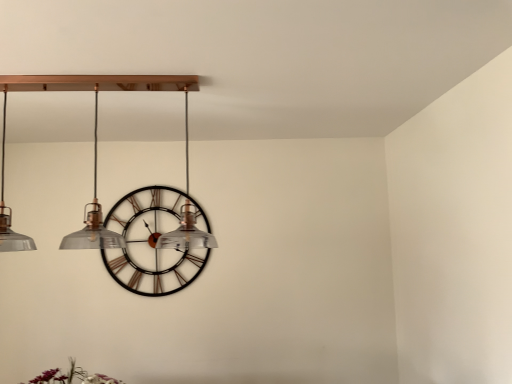
This screenshot has height=384, width=512. What do you see at coordinates (153, 242) in the screenshot?
I see `metallic black clock at center` at bounding box center [153, 242].

Identify the location of metallic black clock at center. This screenshot has width=512, height=384. (153, 242).

Identify the location of matte glass chandelier at upper center. (94, 144).

Describe the element at coordinates (94, 144) in the screenshot. I see `matte glass chandelier at upper center` at that location.

Locate an element on the screen. Image resolution: width=512 pixels, height=384 pixels. metallic black clock at center is located at coordinates (153, 242).

Looking at this image, considering the relative positions of matte glass chandelier at upper center and metallic black clock at center in the image provided, is matte glass chandelier at upper center to the right of metallic black clock at center from the viewer's perspective?

Indeed, matte glass chandelier at upper center is positioned on the right side of metallic black clock at center.

Is matte glass chandelier at upper center in front of or behind metallic black clock at center in the image?

In the image, matte glass chandelier at upper center appears in front of metallic black clock at center.

Is point (131, 84) positioned behind point (192, 257)?

No.

From the image's perspective, is matte glass chandelier at upper center on top of metallic black clock at center?

Yes, from the image's perspective, matte glass chandelier at upper center is on top of metallic black clock at center.

From a real-world perspective, does matte glass chandelier at upper center sit lower than metallic black clock at center?

Actually, matte glass chandelier at upper center is physically above metallic black clock at center in the real world.

Which of these two, matte glass chandelier at upper center or metallic black clock at center, is wider?

matte glass chandelier at upper center is wider.

Is matte glass chandelier at upper center taller or shorter than metallic black clock at center?

matte glass chandelier at upper center is shorter than metallic black clock at center.

Considering the relative sizes of matte glass chandelier at upper center and metallic black clock at center in the image provided, is matte glass chandelier at upper center smaller than metallic black clock at center?

No, matte glass chandelier at upper center is not smaller than metallic black clock at center.

From the picture: Is metallic black clock at center inside matte glass chandelier at upper center?

No, matte glass chandelier at upper center does not contain metallic black clock at center.

Would you consider matte glass chandelier at upper center to be distant from metallic black clock at center?

That's right, there is a large distance between matte glass chandelier at upper center and metallic black clock at center.

Is metallic black clock at center at the back of matte glass chandelier at upper center?

Yes, matte glass chandelier at upper center's orientation is away from metallic black clock at center.

How many degrees apart are the facing directions of matte glass chandelier at upper center and metallic black clock at center?

matte glass chandelier at upper center and metallic black clock at center are facing 2.84 degrees away from each other.

Identify the location of chandelier above the metallic black clock at center (from a real-world perspective). The height and width of the screenshot is (384, 512). (94, 144).

Considering the relative positions of metallic black clock at center and matte glass chandelier at upper center in the image provided, is metallic black clock at center to the right of matte glass chandelier at upper center from the viewer's perspective?

No, metallic black clock at center is not to the right of matte glass chandelier at upper center.

Which object is more forward, metallic black clock at center or matte glass chandelier at upper center?

Positioned in front is matte glass chandelier at upper center.

Which is behind, point (144, 210) or point (29, 81)?

Positioned behind is point (144, 210).

From the image's perspective, which is below, metallic black clock at center or matte glass chandelier at upper center?

metallic black clock at center.

From a real-world perspective, is metallic black clock at center above or below matte glass chandelier at upper center?

metallic black clock at center is below matte glass chandelier at upper center.

Between metallic black clock at center and matte glass chandelier at upper center, which one has larger width?

matte glass chandelier at upper center.

Considering the sizes of objects metallic black clock at center and matte glass chandelier at upper center in the image provided, who is taller, metallic black clock at center or matte glass chandelier at upper center?

Standing taller between the two is metallic black clock at center.

Between metallic black clock at center and matte glass chandelier at upper center, which one has larger size?

matte glass chandelier at upper center.

Is matte glass chandelier at upper center inside metallic black clock at center?

Definitely not — matte glass chandelier at upper center is not inside metallic black clock at center.

Is metallic black clock at center far away from matte glass chandelier at upper center?

Yes.

Could you tell me if metallic black clock at center is turned towards matte glass chandelier at upper center?

Yes, metallic black clock at center faces towards matte glass chandelier at upper center.

How different are the orientations of metallic black clock at center and matte glass chandelier at upper center in degrees?

metallic black clock at center and matte glass chandelier at upper center are facing 2.84 degrees away from each other.

Measure the distance between metallic black clock at center and matte glass chandelier at upper center.

A distance of 1.19 meters exists between metallic black clock at center and matte glass chandelier at upper center.

At what (x,y) coordinates should I click in order to perform the action: click on wall clock to the left of matte glass chandelier at upper center. Please return your answer as a coordinate pair (x, y). This screenshot has height=384, width=512. Looking at the image, I should click on tap(153, 242).

Identify the location of chandelier above the metallic black clock at center (from the image's perspective). (94, 144).

Identify the location of wall clock beneath the matte glass chandelier at upper center (from a real-world perspective). (153, 242).